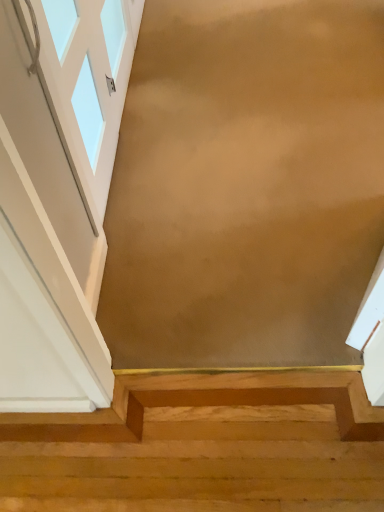
Question: Should I look upward or downward to see light wood stairs at lower center?

Choices:
 (A) up
 (B) down

Answer: (B)

Question: From a real-world perspective, is white glass window at upper left on top of light wood stairs at lower center?

Choices:
 (A) yes
 (B) no

Answer: (A)

Question: Can you confirm if white glass window at upper left is thinner than light wood stairs at lower center?

Choices:
 (A) no
 (B) yes

Answer: (B)

Question: Is white glass window at upper left positioned far away from light wood stairs at lower center?

Choices:
 (A) no
 (B) yes

Answer: (B)

Question: Considering the relative sizes of white glass window at upper left and light wood stairs at lower center in the image provided, is white glass window at upper left taller than light wood stairs at lower center?

Choices:
 (A) no
 (B) yes

Answer: (B)

Question: Is white glass window at upper left positioned behind light wood stairs at lower center?

Choices:
 (A) yes
 (B) no

Answer: (B)

Question: Can you confirm if white glass window at upper left is shorter than light wood stairs at lower center?

Choices:
 (A) no
 (B) yes

Answer: (A)

Question: From the image's perspective, is light wood stairs at lower center on white glass window at upper left?

Choices:
 (A) yes
 (B) no

Answer: (B)

Question: Can you confirm if light wood stairs at lower center is wider than white glass window at upper left?

Choices:
 (A) yes
 (B) no

Answer: (A)

Question: Is light wood stairs at lower center facing away from white glass window at upper left?

Choices:
 (A) yes
 (B) no

Answer: (B)

Question: Are light wood stairs at lower center and white glass window at upper left far apart?

Choices:
 (A) no
 (B) yes

Answer: (B)

Question: From the image's perspective, does light wood stairs at lower center appear lower than white glass window at upper left?

Choices:
 (A) yes
 (B) no

Answer: (A)

Question: Is light wood stairs at lower center facing towards white glass window at upper left?

Choices:
 (A) yes
 (B) no

Answer: (B)

Question: From a real-world perspective, is light wood stairs at lower center above or below white glass window at upper left?

Choices:
 (A) below
 (B) above

Answer: (A)